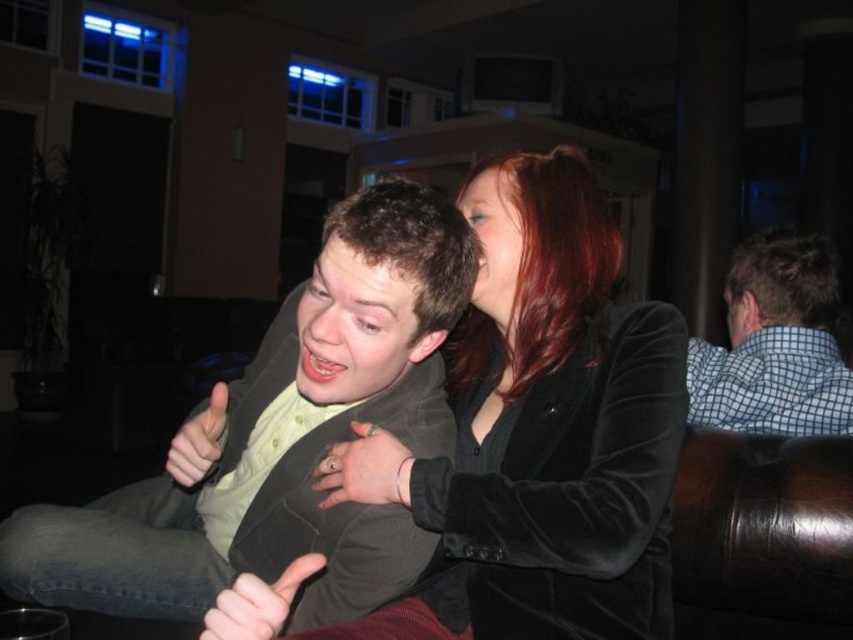
Question: Does velvet black jacket at upper center appear on the right side of matte blue shirt at upper right?

Choices:
 (A) no
 (B) yes

Answer: (A)

Question: Which of the following is the closest to the observer?

Choices:
 (A) velvet black jacket at upper center
 (B) smooth red hair at upper center
 (C) matte black face at center

Answer: (A)

Question: Which of the following is the farthest from the observer?

Choices:
 (A) velvet black jacket at upper center
 (B) checkered fabric shirt at right

Answer: (B)

Question: Does matte black face at center lie behind matte blue shirt at upper right?

Choices:
 (A) yes
 (B) no

Answer: (B)

Question: Which point is farther from the camera taking this photo?

Choices:
 (A) (791, 362)
 (B) (486, 330)

Answer: (A)

Question: Does velvet black jacket at upper center lie behind matte green shirt at center?

Choices:
 (A) no
 (B) yes

Answer: (A)